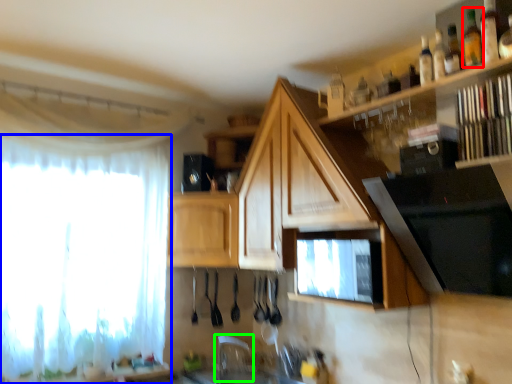
Question: Which object is positioned farthest from bottle (highlighted by a red box)? Select from curtain (highlighted by a blue box) and faucet (highlighted by a green box).

Choices:
 (A) curtain
 (B) faucet

Answer: (B)